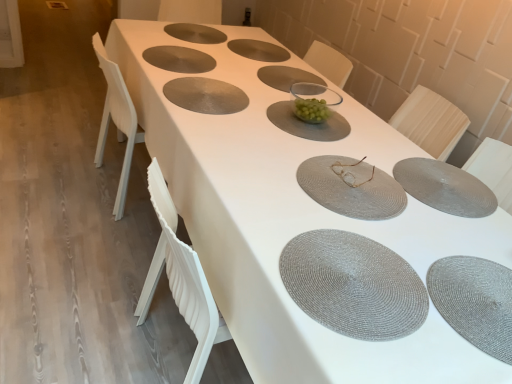
Find the location of a particular element. vacant space that's between gray woven placemat at center and matte gray placemat at center, the seventh tableware when ordered from top to bottom is located at coordinates (267, 134).